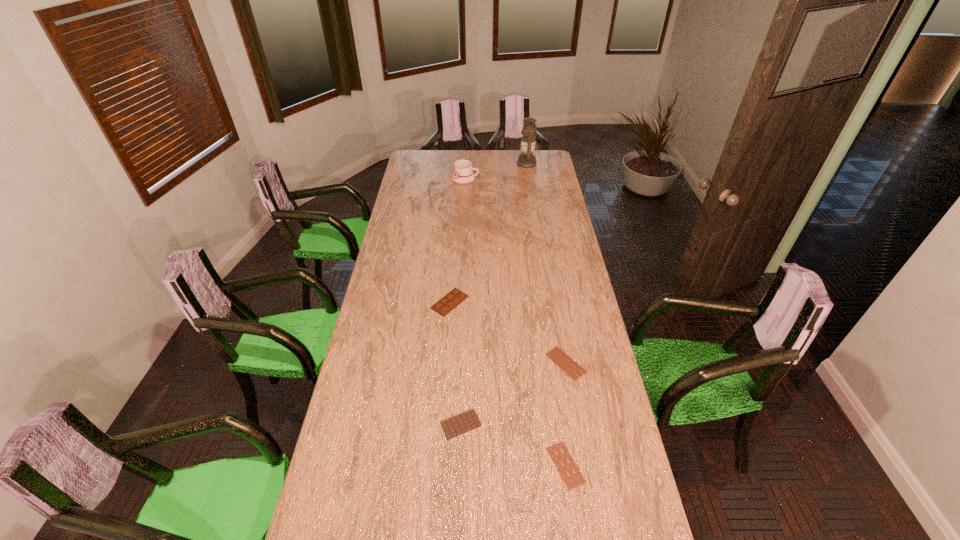
Find the location of a particular element. This screenshot has height=540, width=960. vacant region between the third nearest chocolate bar and the farthest chocolate bar is located at coordinates pos(508,333).

Locate an element on the screen. Image resolution: width=960 pixels, height=540 pixels. vacant area between the nearest chocolate bar and the farthest object is located at coordinates (547, 314).

Locate an element on the screen. vacant space that's between the oil lamp and the nearest object is located at coordinates (547, 314).

Identify which object is located as the third nearest to the mug. Please provide its 2D coordinates. Your answer should be formatted as a tuple, i.e. [(x, y)], where the tuple contains the x and y coordinates of a point satisfying the conditions above.

[(560, 358)]

Locate an element on the screen. Image resolution: width=960 pixels, height=540 pixels. object that is the second closest to the third shortest object is located at coordinates (560, 358).

The image size is (960, 540). Find the location of `chocolate bar that is the third closest to the farthest object`. chocolate bar that is the third closest to the farthest object is located at coordinates (467, 421).

Image resolution: width=960 pixels, height=540 pixels. Find the location of `chocolate bar that stands as the second closest to the second farthest chocolate bar`. chocolate bar that stands as the second closest to the second farthest chocolate bar is located at coordinates click(x=467, y=421).

Locate an element on the screen. vacant space that satisfies the following two spatial constraints: 1. on the front side of the farthest object; 2. on the side with the handle of the fifth nearest object is located at coordinates (531, 179).

I want to click on free space that satisfies the following two spatial constraints: 1. on the side with the handle of the second farthest chocolate bar; 2. on the left side of the fifth nearest object, so click(x=456, y=363).

This screenshot has height=540, width=960. In order to click on vacant space that satisfies the following two spatial constraints: 1. on the side with the handle of the second nearest chocolate bar; 2. on the left side of the second farthest object in this screenshot , I will do `click(453, 424)`.